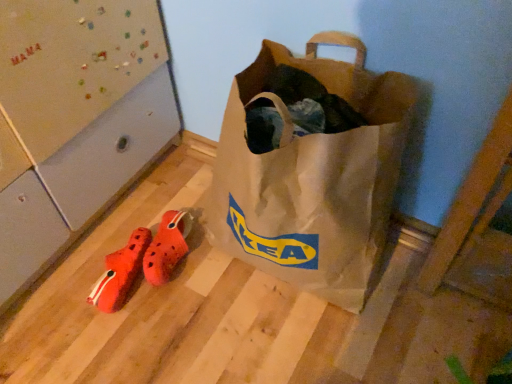
Where is `vacant space behind orange fabric shoe at lower left`? This screenshot has height=384, width=512. vacant space behind orange fabric shoe at lower left is located at coordinates (134, 218).